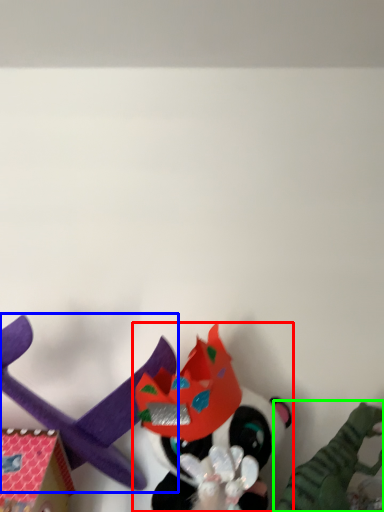
Question: Which is farther away from toy (highlighted by a red box)? toy (highlighted by a blue box) or toy (highlighted by a green box)?

Choices:
 (A) toy
 (B) toy

Answer: (B)